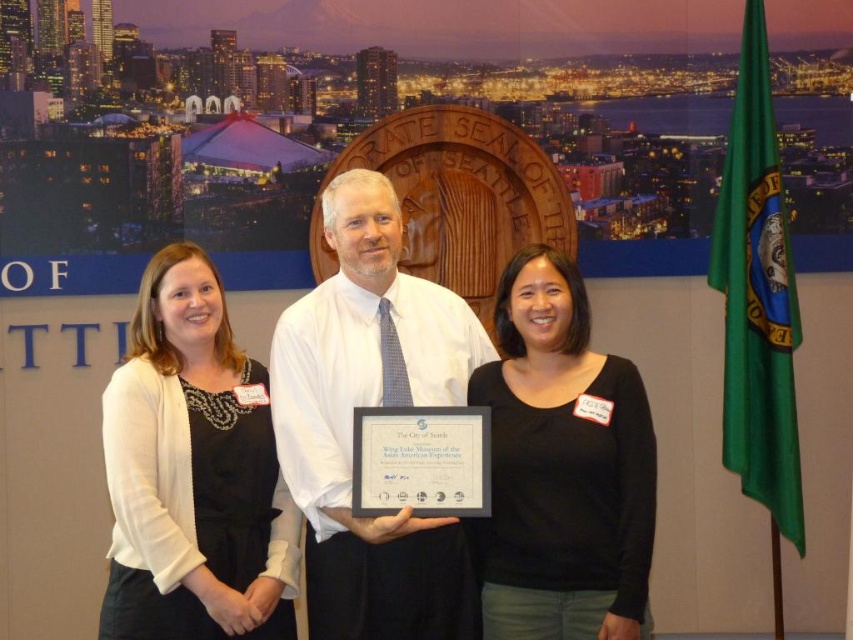
Question: Among these points, which one is farthest from the camera?

Choices:
 (A) (142, 628)
 (B) (500, 625)

Answer: (B)

Question: Where is white shirt at center located in relation to white paper at center in the image?

Choices:
 (A) right
 (B) left

Answer: (B)

Question: Can you confirm if white shirt at center is smaller than black matte shirt at center?

Choices:
 (A) no
 (B) yes

Answer: (A)

Question: Among these objects, which one is farthest from the camera?

Choices:
 (A) black matte dress at left
 (B) black matte shirt at center

Answer: (B)

Question: Does white shirt at center have a larger size compared to black matte shirt at center?

Choices:
 (A) yes
 (B) no

Answer: (A)

Question: Which point is farther to the camera?

Choices:
 (A) coord(106,454)
 (B) coord(549,348)
 (C) coord(462,476)

Answer: (B)